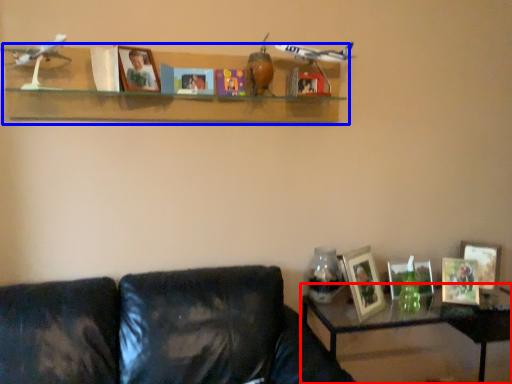
Question: Which object appears closest to the camera in this image, table (highlighted by a red box) or shelf (highlighted by a blue box)?

Choices:
 (A) table
 (B) shelf

Answer: (B)